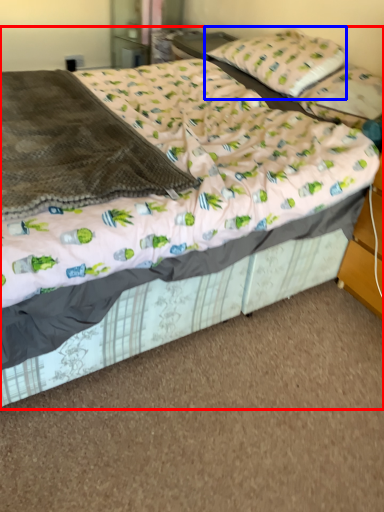
Question: Among these objects, which one is farthest to the camera, bed (highlighted by a red box) or pillow (highlighted by a blue box)?

Choices:
 (A) bed
 (B) pillow

Answer: (B)